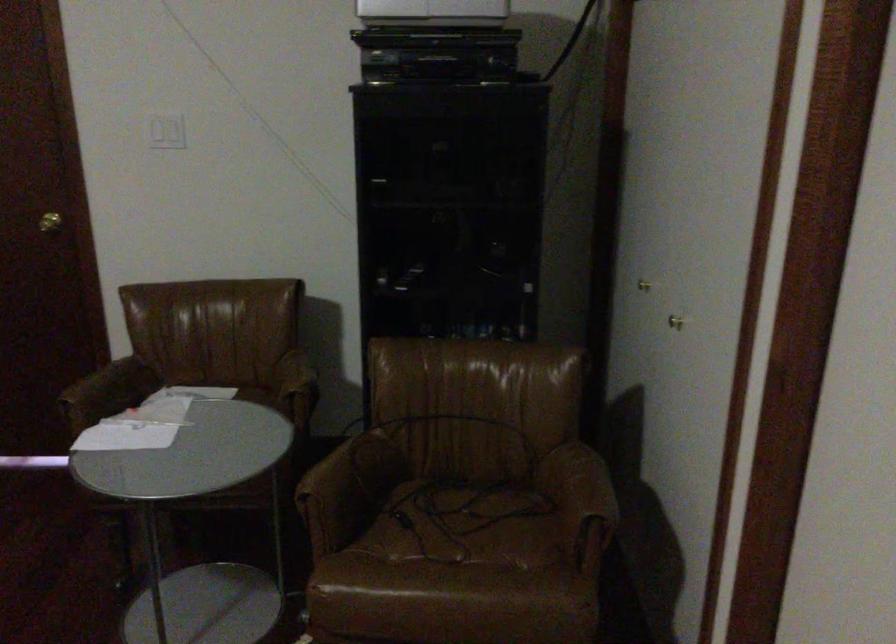
Find the location of a particular element. The width and height of the screenshot is (896, 644). closet door knob is located at coordinates (49, 222).